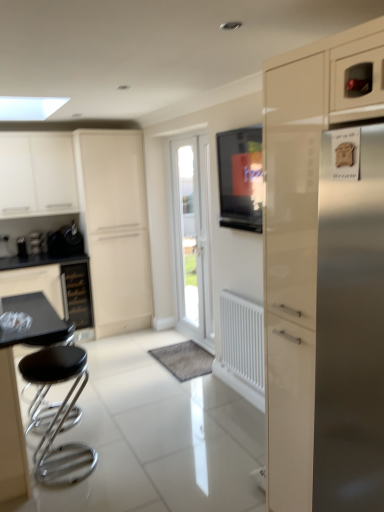
Measure the distance between black leather stool at lower left and camera.

2.36 meters.

In order to face glossy cream cabinet at right, arranged as the 1th cabinetry when viewed from the right, should I rotate leftwards or rightwards?

A 22.201 degree turn to the right will do.

The height and width of the screenshot is (512, 384). What do you see at coordinates (37, 175) in the screenshot?
I see `white glossy cabinet at upper left, marked as the first cabinetry in a left-to-right arrangement` at bounding box center [37, 175].

The height and width of the screenshot is (512, 384). What do you see at coordinates (242, 338) in the screenshot? I see `white plastic radiator at center` at bounding box center [242, 338].

Locate an element on the screen. black leather stool at lower left is located at coordinates (60, 414).

Consider the image. Is black leather stool at lower left located within white glossy cabinet at upper left, the second cabinetry from the front?

No, black leather stool at lower left is not inside white glossy cabinet at upper left, the second cabinetry from the front.

Is white glossy cabinet at upper left, the second cabinetry in the right-to-left sequence, looking in the opposite direction of black leather stool at lower left?

No, white glossy cabinet at upper left, the second cabinetry in the right-to-left sequence, is not facing the opposite direction of black leather stool at lower left.

From the image's perspective, would you say white glossy cabinet at upper left, marked as the first cabinetry in a left-to-right arrangement, is shown under black leather stool at lower left?

No, from the image's perspective, white glossy cabinet at upper left, marked as the first cabinetry in a left-to-right arrangement, is not below black leather stool at lower left.

Does white glossy cabinet at center have a smaller size compared to black glass drawer at lower left?

Actually, white glossy cabinet at center might be larger than black glass drawer at lower left.

Which is closer to the camera, [74,148] or [80,287]?

Point [74,148].

Can you tell me how much white glossy cabinet at center and black glass drawer at lower left differ in facing direction?

Result: 0.000146 degrees.

The image size is (384, 512). Identify the location of screen door to the right of black glass drawer at lower left. (115, 228).

From the image's perspective, is black leather stool at lower left under black glass drawer at lower left?

Yes, from the image's perspective, black leather stool at lower left is beneath black glass drawer at lower left.

In the scene shown: How distant is black leather stool at lower left from black glass drawer at lower left?

black leather stool at lower left and black glass drawer at lower left are 4.25 feet apart.

From a real-world perspective, is black leather stool at lower left below black glass drawer at lower left?

Yes, from a real-world perspective, black leather stool at lower left is beneath black glass drawer at lower left.

Considering the sizes of objects black leather stool at lower left and black glass drawer at lower left in the image provided, who is taller, black leather stool at lower left or black glass drawer at lower left?

With more height is black glass drawer at lower left.

Which is more to the left, white glossy door at center or black glass drawer at lower left?

Positioned to the left is black glass drawer at lower left.

Based on the photo, is white glossy door at center directly adjacent to black glass drawer at lower left?

No, white glossy door at center is not in contact with black glass drawer at lower left.

From a real-world perspective, does white glossy door at center stand above black glass drawer at lower left?

Yes, from a real-world perspective, white glossy door at center is above black glass drawer at lower left.

Which object is further away from the camera, white plastic radiator at center or glossy cream cabinet at right, marked as the second cabinetry in a left-to-right arrangement?

white plastic radiator at center is further from the camera.

From a real-world perspective, who is located higher, white plastic radiator at center or glossy cream cabinet at right, arranged as the 1th cabinetry when viewed from the right?

From a 3D spatial view, glossy cream cabinet at right, arranged as the 1th cabinetry when viewed from the right, is above.

Can you confirm if white plastic radiator at center is taller than glossy cream cabinet at right, marked as the second cabinetry in a left-to-right arrangement?

No.

From the image's perspective, does white plastic radiator at center appear lower than glossy cream cabinet at right, marked as the second cabinetry in a left-to-right arrangement?

Indeed, from the image's perspective, white plastic radiator at center is shown beneath glossy cream cabinet at right, marked as the second cabinetry in a left-to-right arrangement.

Between metallic black kettle at left and satin black coffee machine at left, which one appears on the right side from the viewer's perspective?

From the viewer's perspective, metallic black kettle at left appears more on the right side.

Is metallic black kettle at left facing away from satin black coffee machine at left?

No, metallic black kettle at left is not facing away from satin black coffee machine at left.

Between metallic black kettle at left and satin black coffee machine at left, which one has less height?

satin black coffee machine at left.

Can you confirm if metallic black kettle at left is smaller than satin black coffee machine at left?

No.

Is metallic black kettle at left inside the boundaries of white glossy cabinet at center, or outside?

metallic black kettle at left is spatially situated outside white glossy cabinet at center.

Between metallic black kettle at left and white glossy cabinet at center, which one has less height?

metallic black kettle at left.

Looking at this image, from the image's perspective, is metallic black kettle at left located beneath white glossy cabinet at center?

Yes, from the image's perspective, metallic black kettle at left is below white glossy cabinet at center.

Which point is more distant from viewer, [76,231] or [79,154]?

The point [76,231] is farther.

The height and width of the screenshot is (512, 384). I want to click on the 2nd cabinetry above the black leather stool at lower left (from the image's perspective), so click(37, 175).

The image size is (384, 512). Identify the location of screen door on the right of black glass drawer at lower left. (115, 228).

From the image, which object appears to be farther from white plastic radiator at center, matte black tv at center or white glossy cabinet at center?

white glossy cabinet at center lies further to white plastic radiator at center than the other object.

Considering their positions, is white glossy cabinet at upper left, the 1th cabinetry positioned from the back, positioned further to glossy cream cabinet at right, marked as the second cabinetry in a left-to-right arrangement, than white glossy door at center?

Among the two, white glossy cabinet at upper left, the 1th cabinetry positioned from the back, is located further to glossy cream cabinet at right, marked as the second cabinetry in a left-to-right arrangement.

Based on their spatial positions, is white plastic radiator at center or glossy cream cabinet at right, marked as the second cabinetry in a left-to-right arrangement, closer to black leather stool at lower left?

white plastic radiator at center is closer to black leather stool at lower left.

Which object lies further to the anchor point white glossy cabinet at center, satin black coffee machine at left or white glossy door at center?

satin black coffee machine at left lies further to white glossy cabinet at center than the other object.

From the image, which object appears to be farther from glossy cream cabinet at right, which appears as the 2th cabinetry when viewed from the back, metallic black kettle at left or white plastic radiator at center?

Based on the image, metallic black kettle at left appears to be further to glossy cream cabinet at right, which appears as the 2th cabinetry when viewed from the back.

Based on the photo, from the image, which object appears to be nearer to black glass drawer at lower left, white glossy cabinet at center or matte black tv at center?

white glossy cabinet at center is positioned closer to the anchor black glass drawer at lower left.

Which object lies further to the anchor point white plastic radiator at center, black glass drawer at lower left or satin black coffee machine at left?

Among the two, satin black coffee machine at left is located further to white plastic radiator at center.

From the image, which object appears to be nearer to metallic black kettle at left, black leather stool at lower left or white glossy door at center?

white glossy door at center.

Identify the location of drawer between white glossy cabinet at upper left, the 1th cabinetry positioned from the back, and white glossy door at center, in the horizontal direction. (78, 294).

The width and height of the screenshot is (384, 512). I want to click on cabinetry situated between satin black coffee machine at left and white glossy door at center from left to right, so click(37, 175).

I want to click on screen door between black glass drawer at lower left and white plastic radiator at center, so click(x=115, y=228).

Image resolution: width=384 pixels, height=512 pixels. Identify the location of door between matte black tv at center and white glossy cabinet at center along the z-axis. (192, 233).